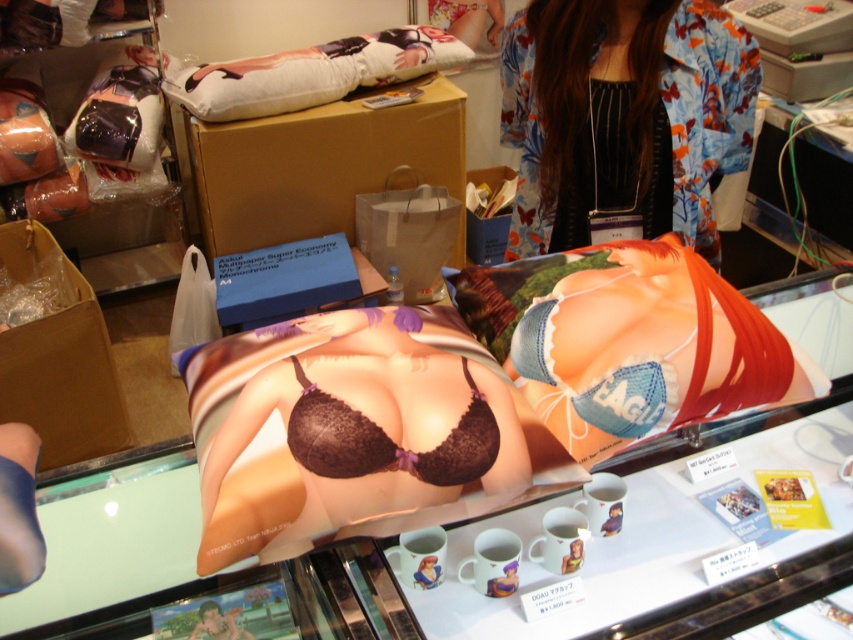
Question: Is floral kimono at upper center wider than lace dark brown bikini top at center?

Choices:
 (A) no
 (B) yes

Answer: (B)

Question: Which object appears closest to the camera in this image?

Choices:
 (A) lace dark brown bikini top at center
 (B) floral kimono at upper center

Answer: (A)

Question: Which of the following is the closest to the observer?

Choices:
 (A) lace dark brown bikini top at center
 (B) floral kimono at upper center

Answer: (A)

Question: Can you confirm if floral kimono at upper center is bigger than lace dark brown bikini top at center?

Choices:
 (A) no
 (B) yes

Answer: (B)

Question: Which object is farther from the camera taking this photo?

Choices:
 (A) lace dark brown bikini top at center
 (B) floral kimono at upper center

Answer: (B)

Question: Does floral kimono at upper center appear over lace dark brown bikini top at center?

Choices:
 (A) no
 (B) yes

Answer: (B)